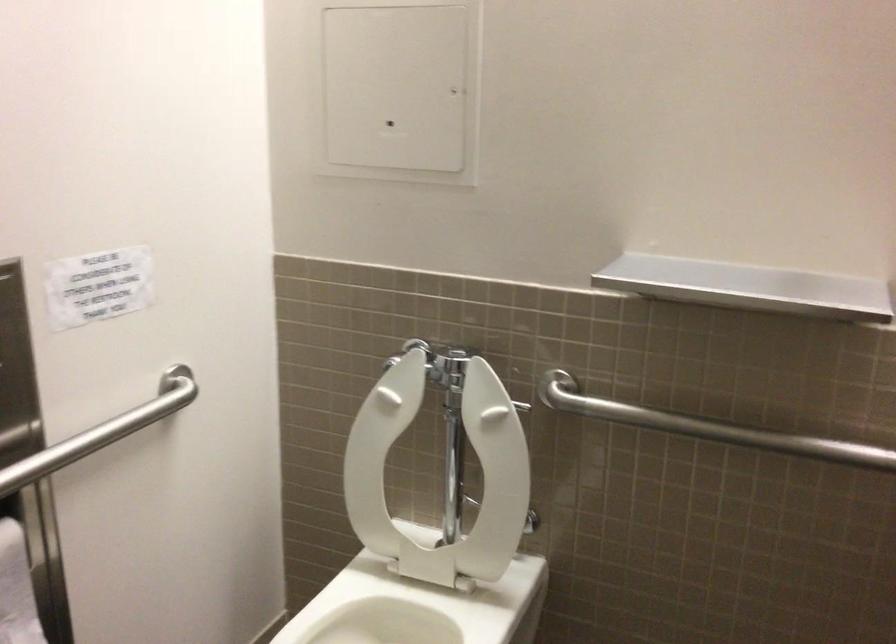
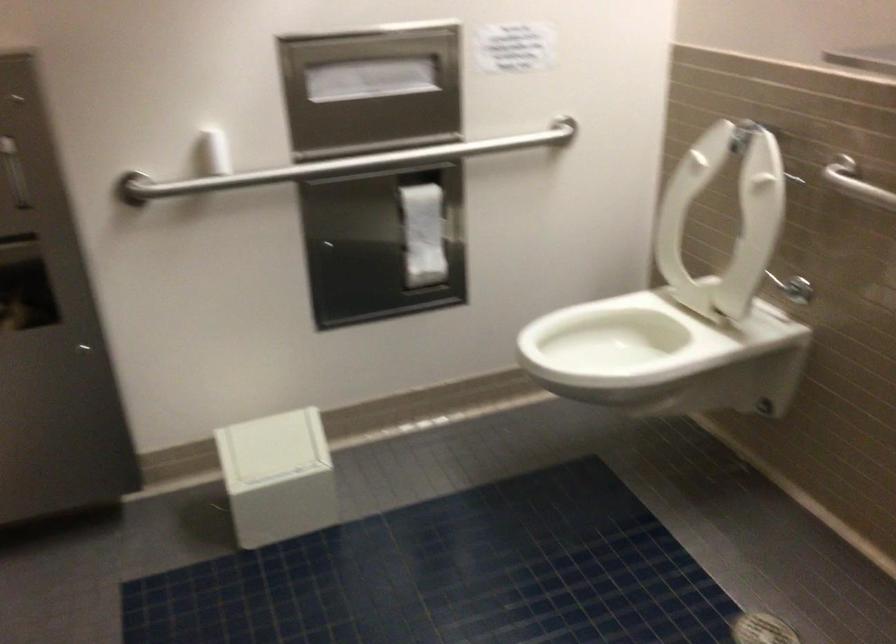
Locate, in the second image, the point that corresponds to (400,456) in the first image.

(724, 219)